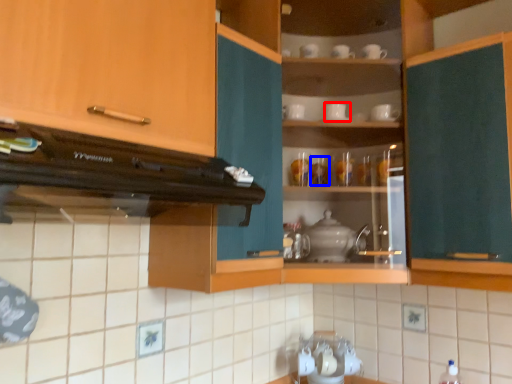
Question: Which of the following is the closest to the observer, tableware (highlighted by a red box) or tableware (highlighted by a blue box)?

Choices:
 (A) tableware
 (B) tableware

Answer: (A)